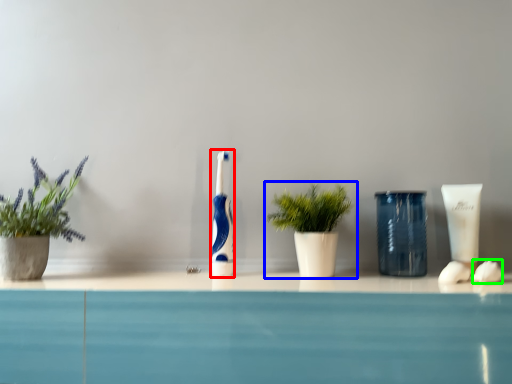
Question: Considering the real-world distances, which object is farthest from toothbrush (highlighted by a red box)? houseplant (highlighted by a blue box) or soap (highlighted by a green box)?

Choices:
 (A) houseplant
 (B) soap

Answer: (B)